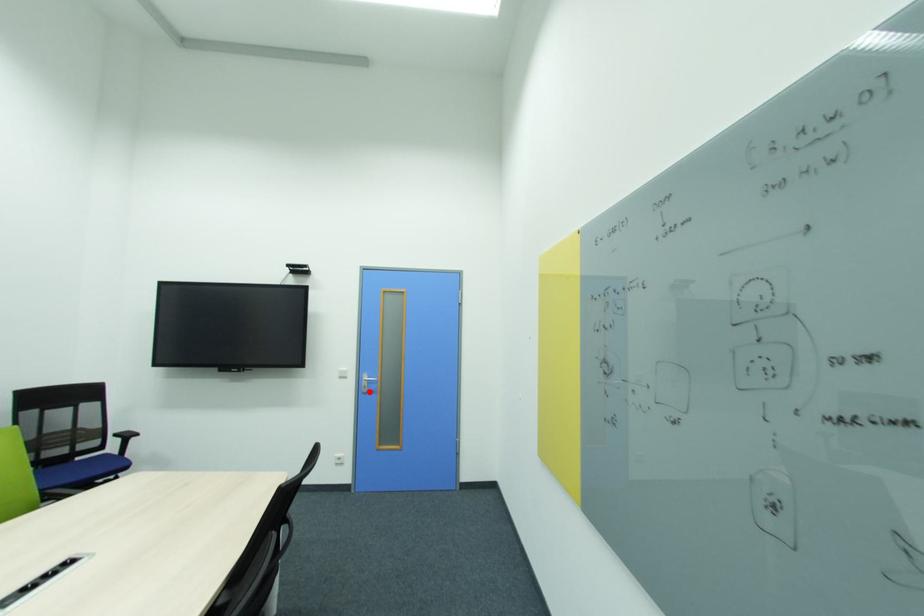
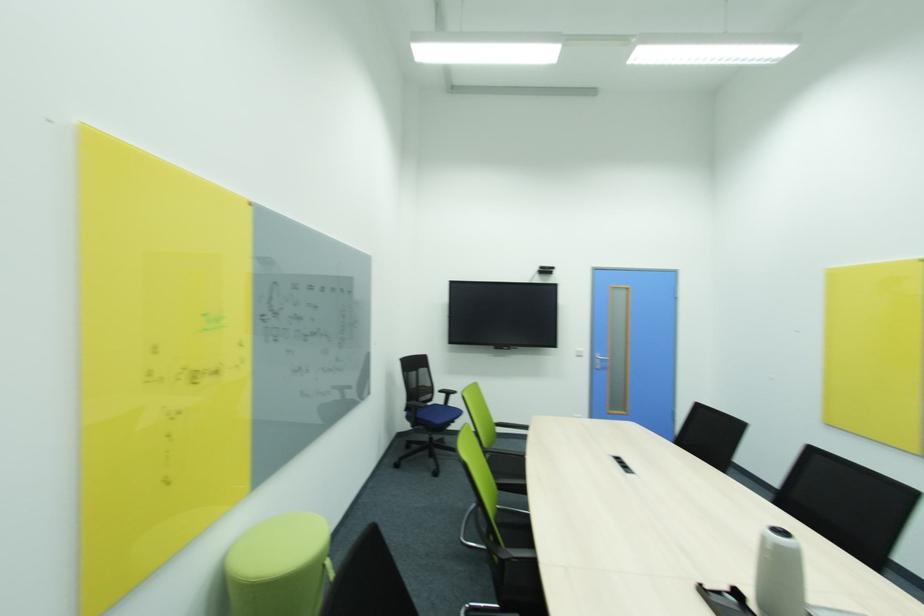
The point at the highlighted location is marked in the first image. Where is the corresponding point in the second image?

(602, 368)